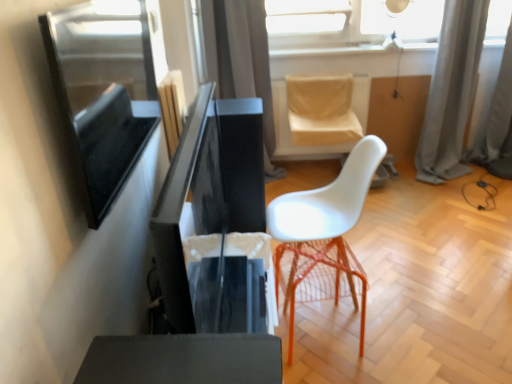
Describe the element at coordinates (320, 115) in the screenshot. I see `beige fabric swivel chair at upper center` at that location.

At what (x,y) coordinates should I click in order to perform the action: click on matte black screen at left. Please return your answer as a coordinate pair (x, y). This screenshot has height=384, width=512. Looking at the image, I should click on click(102, 93).

The image size is (512, 384). What do you see at coordinates (208, 189) in the screenshot?
I see `glossy black computer desk at center` at bounding box center [208, 189].

In order to click on transparent glass lampshade at upper center in this screenshot , I will do `click(403, 20)`.

Describe the element at coordinates (403, 20) in the screenshot. Image resolution: width=512 pixels, height=384 pixels. I see `transparent glass lampshade at upper center` at that location.

What is the approximate width of white plastic chair at center?

white plastic chair at center is 21.38 inches in width.

Based on the photo, measure the distance between point (335, 246) and camera.

They are 6.43 feet apart.

Locate an element on the screen. The width and height of the screenshot is (512, 384). beige fabric swivel chair at upper center is located at coordinates (320, 115).

Could you measure the distance between satin gray curtain at upper center, which ranks as the third curtain in right-to-left order, and white plastic chair at center?

The distance of satin gray curtain at upper center, which ranks as the third curtain in right-to-left order, from white plastic chair at center is 1.37 meters.

Considering the points (217, 47) and (344, 198), which point is in front, point (217, 47) or point (344, 198)?

The point (344, 198) is in front.

In the scene shown: From their relative heights in the image, would you say satin gray curtain at upper center, which is the 1th curtain in left-to-right order, is taller or shorter than white plastic chair at center?

satin gray curtain at upper center, which is the 1th curtain in left-to-right order, is taller than white plastic chair at center.

From a real-world perspective, count 3rd curtains upward from the white plastic chair at center and point to it. Please provide its 2D coordinates.

[(241, 60)]

Is white plastic chair at center turned away from beige fabric swivel chair at upper center?

That's not correct — white plastic chair at center is not looking away from beige fabric swivel chair at upper center.

The width and height of the screenshot is (512, 384). Find the location of `swivel chair that is behind the white plastic chair at center`. swivel chair that is behind the white plastic chair at center is located at coordinates (320, 115).

How much distance is there between white plastic chair at center and beige fabric swivel chair at upper center?

white plastic chair at center is 4.10 feet away from beige fabric swivel chair at upper center.

Is beige fabric swivel chair at upper center a part of white plastic chair at center?

No, beige fabric swivel chair at upper center is not surrounded by white plastic chair at center.

Is matte black screen at left turned away from beige fabric swivel chair at upper center?

No, matte black screen at left is not facing away from beige fabric swivel chair at upper center.

Which is less distant, (66, 129) or (309, 115)?

Point (66, 129) is closer to the camera than point (309, 115).

Considering the sizes of matte black screen at left and beige fabric swivel chair at upper center in the image, is matte black screen at left taller or shorter than beige fabric swivel chair at upper center?

matte black screen at left is taller than beige fabric swivel chair at upper center.

Considering the positions of objects matte black screen at left and beige fabric swivel chair at upper center in the image provided, who is more to the right, matte black screen at left or beige fabric swivel chair at upper center?

Positioned to the right is beige fabric swivel chair at upper center.

From a real-world perspective, is gray fabric curtain at upper right, which is the second curtain in left-to-right order, physically below matte black screen at left?

Yes, from a real-world perspective, gray fabric curtain at upper right, which is the second curtain in left-to-right order, is under matte black screen at left.

Which object is wider, gray fabric curtain at upper right, which is the second curtain in left-to-right order, or matte black screen at left?

With larger width is gray fabric curtain at upper right, which is the second curtain in left-to-right order.

Is gray fabric curtain at upper right, which is the 2th curtain in right-to-left order, inside the boundaries of matte black screen at left, or outside?

gray fabric curtain at upper right, which is the 2th curtain in right-to-left order, is outside matte black screen at left.

Considering the points (449, 83) and (118, 44), which point is behind, point (449, 83) or point (118, 44)?

Positioned behind is point (449, 83).

Where is `chair located on the left of gray fabric curtain at upper right, acting as the 3th curtain starting from the left`? The height and width of the screenshot is (384, 512). chair located on the left of gray fabric curtain at upper right, acting as the 3th curtain starting from the left is located at coordinates (324, 235).

In the image, is white plastic chair at center positioned in front of or behind gray fabric curtain at upper right, acting as the 3th curtain starting from the left?

Visually, white plastic chair at center is located in front of gray fabric curtain at upper right, acting as the 3th curtain starting from the left.

Based on the photo, is white plastic chair at center located outside gray fabric curtain at upper right, which is the 1th curtain from right to left?

That's correct, white plastic chair at center is outside of gray fabric curtain at upper right, which is the 1th curtain from right to left.

Would you say satin gray curtain at upper center, which is the 1th curtain in left-to-right order, is outside gray fabric curtain at upper right, which is the 2th curtain in right-to-left order?

Yes, satin gray curtain at upper center, which is the 1th curtain in left-to-right order, is outside of gray fabric curtain at upper right, which is the 2th curtain in right-to-left order.

Visually, is satin gray curtain at upper center, which ranks as the third curtain in right-to-left order, positioned to the left or to the right of gray fabric curtain at upper right, which is the second curtain in left-to-right order?

Based on their positions, satin gray curtain at upper center, which ranks as the third curtain in right-to-left order, is located to the left of gray fabric curtain at upper right, which is the second curtain in left-to-right order.

Can you confirm if transparent glass lampshade at upper center is bigger than glossy black computer desk at center?

No, transparent glass lampshade at upper center is not bigger than glossy black computer desk at center.

Could you tell me if transparent glass lampshade at upper center is facing glossy black computer desk at center?

No, transparent glass lampshade at upper center is not turned towards glossy black computer desk at center.

Who is taller, transparent glass lampshade at upper center or glossy black computer desk at center?

glossy black computer desk at center is taller.

How different are the orientations of transparent glass lampshade at upper center and glossy black computer desk at center in degrees?

They differ by 84.3 degrees in their facing directions.

Where is `chair in front of the satin gray curtain at upper center, which ranks as the third curtain in right-to-left order`? The image size is (512, 384). chair in front of the satin gray curtain at upper center, which ranks as the third curtain in right-to-left order is located at coordinates (324, 235).

Locate an element on the screen. chair located below the beige fabric swivel chair at upper center (from the image's perspective) is located at coordinates (324, 235).

Based on their spatial positions, is matte black screen at left or beige fabric swivel chair at upper center closer to glossy black computer desk at center?

Among the two, matte black screen at left is located nearer to glossy black computer desk at center.

From the picture: Which object lies further to the anchor point matte black screen at left, satin gray curtain at upper center, which ranks as the third curtain in right-to-left order, or white plastic chair at center?

The object further to matte black screen at left is satin gray curtain at upper center, which ranks as the third curtain in right-to-left order.

Based on their spatial positions, is matte black screen at left or satin gray curtain at upper center, which is the 1th curtain in left-to-right order, closer to glossy black computer desk at center?

matte black screen at left is positioned closer to the anchor glossy black computer desk at center.

Looking at the image, which one is located further to glossy black computer desk at center, beige fabric swivel chair at upper center or transparent glass lampshade at upper center?

Based on the image, transparent glass lampshade at upper center appears to be further to glossy black computer desk at center.

Considering their positions, is gray fabric curtain at upper right, which is the 2th curtain in right-to-left order, positioned closer to matte black screen at left than gray fabric curtain at upper right, which is the 1th curtain from right to left?

gray fabric curtain at upper right, which is the 2th curtain in right-to-left order, is closer to matte black screen at left.

Looking at the image, which one is located closer to gray fabric curtain at upper right, which is the 2th curtain in right-to-left order, transparent glass lampshade at upper center or satin gray curtain at upper center, which is the 1th curtain in left-to-right order?

Based on the image, transparent glass lampshade at upper center appears to be nearer to gray fabric curtain at upper right, which is the 2th curtain in right-to-left order.

Considering their positions, is beige fabric swivel chair at upper center positioned further to satin gray curtain at upper center, which ranks as the third curtain in right-to-left order, than white plastic chair at center?

white plastic chair at center lies further to satin gray curtain at upper center, which ranks as the third curtain in right-to-left order, than the other object.

Estimate the real-world distances between objects in this image. Which object is further from gray fabric curtain at upper right, which is the 2th curtain in right-to-left order, gray fabric curtain at upper right, which is the 1th curtain from right to left, or glossy black computer desk at center?

Based on the image, glossy black computer desk at center appears to be further to gray fabric curtain at upper right, which is the 2th curtain in right-to-left order.

At what (x,y) coordinates should I click in order to perform the action: click on curtain between satin gray curtain at upper center, which is the 1th curtain in left-to-right order, and gray fabric curtain at upper right, which is the 1th curtain from right to left. Please return your answer as a coordinate pair (x, y). The height and width of the screenshot is (384, 512). Looking at the image, I should click on (451, 91).

What are the coordinates of `computer desk between matte black screen at left and gray fabric curtain at upper right, which is the second curtain in left-to-right order, along the z-axis` in the screenshot? It's located at (208, 189).

Find the location of a particular element. The width and height of the screenshot is (512, 384). window situated between beige fabric swivel chair at upper center and gray fabric curtain at upper right, acting as the 3th curtain starting from the left, from left to right is located at coordinates (403, 20).

You are a GUI agent. You are given a task and a screenshot of the screen. Output one action in this format:
    pyautogui.click(x=<x>, y=<y>)
    Task: Click on the swivel chair between white plastic chair at center and gray fabric curtain at upper right, which is the 1th curtain from right to left, from left to right
    The height and width of the screenshot is (384, 512).
    Given the screenshot: What is the action you would take?
    pyautogui.click(x=320, y=115)